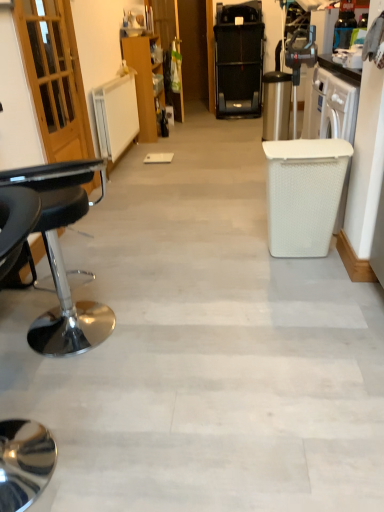
Question: Does black leather stool at left have a lesser height compared to wooden cabinet at center?

Choices:
 (A) no
 (B) yes

Answer: (B)

Question: Can you see black leather stool at left touching wooden cabinet at center?

Choices:
 (A) yes
 (B) no

Answer: (B)

Question: From a real-world perspective, does black leather stool at left sit lower than wooden cabinet at center?

Choices:
 (A) yes
 (B) no

Answer: (A)

Question: Does black leather stool at left have a greater width compared to wooden cabinet at center?

Choices:
 (A) no
 (B) yes

Answer: (B)

Question: Is black leather stool at left not within wooden cabinet at center?

Choices:
 (A) yes
 (B) no

Answer: (A)

Question: Does black leather stool at left turn towards wooden cabinet at center?

Choices:
 (A) yes
 (B) no

Answer: (A)

Question: Is the position of black plastic treadmill at upper center less distant than that of wooden cabinet at center?

Choices:
 (A) yes
 (B) no

Answer: (B)

Question: Is the position of black plastic treadmill at upper center more distant than that of wooden cabinet at center?

Choices:
 (A) yes
 (B) no

Answer: (A)

Question: From the image's perspective, is black plastic treadmill at upper center under wooden cabinet at center?

Choices:
 (A) no
 (B) yes

Answer: (A)

Question: From the image's perspective, does black plastic treadmill at upper center appear higher than wooden cabinet at center?

Choices:
 (A) no
 (B) yes

Answer: (B)

Question: Is black plastic treadmill at upper center positioned with its back to wooden cabinet at center?

Choices:
 (A) no
 (B) yes

Answer: (A)

Question: Is black plastic treadmill at upper center to the right of wooden cabinet at center from the viewer's perspective?

Choices:
 (A) no
 (B) yes

Answer: (B)

Question: From a real-world perspective, is black leather stool at left positioned under black plastic treadmill at upper center based on gravity?

Choices:
 (A) no
 (B) yes

Answer: (B)